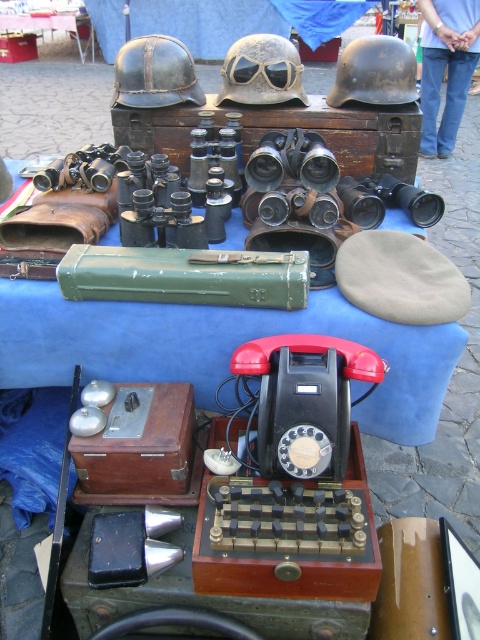
Consider the image. You are a collector looking to purchase items from this flea market display. You see the green leather case at upper center and the matte black helmet at upper left. Which item is located closer to the bottom of the display?

The green leather case at upper center is positioned under the matte black helmet at upper left, meaning it is closer to the bottom of the display.

You are a collector looking to purchase a helmet that can accommodate a head circumference of 25 inches. The matte black helmet at upper left has a width of 24 inches, while the matte brown helmet at center measures 22 inches. Which helmet would be a better fit for your head size?

The matte black helmet at upper left has a width of 24 inches, which is closer to your 25 inches head circumference compared to the matte brown helmet at center at 22 inches. However, neither helmet may provide a perfect fit. The matte black helmet at upper left might be the better option as it is wider, but there could still be a slight size difference.

You are a collector looking to purchase a helmet from the vintage display. You notice two helmets labeled as the matte black helmet at upper left and the matte brown helmet at center. Which helmet is positioned higher up on the display?

The matte brown helmet at center is positioned higher up on the display than the matte black helmet at upper left.